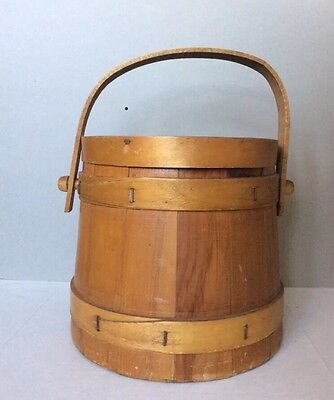
You are a GUI agent. You are given a task and a screenshot of the screen. Output one action in this format:
    pyautogui.click(x=<x>, y=<y>)
    Task: Click on the small wooden knobs
    
    Given the screenshot: What is the action you would take?
    pyautogui.click(x=62, y=181), pyautogui.click(x=292, y=189)